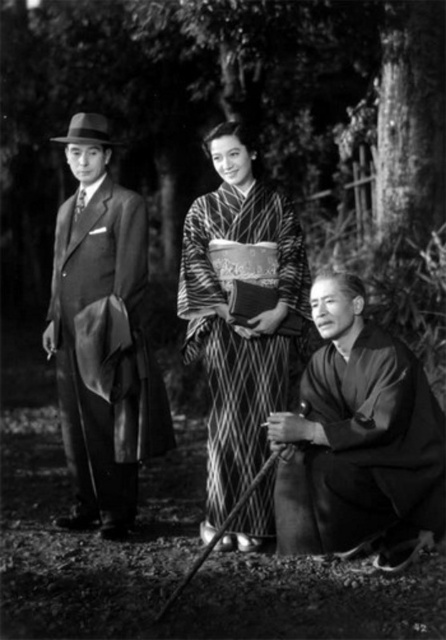
Question: Does silky kimono at lower right lie in front of silky kimono at center?

Choices:
 (A) yes
 (B) no

Answer: (A)

Question: Does silky kimono at lower right appear on the left side of silky kimono at center?

Choices:
 (A) yes
 (B) no

Answer: (B)

Question: Can you confirm if silky kimono at lower right is wider than silky kimono at center?

Choices:
 (A) yes
 (B) no

Answer: (A)

Question: Which of the following is the closest to the observer?

Choices:
 (A) (263, 346)
 (B) (433, 508)
 (C) (82, 440)

Answer: (B)

Question: Which of the following is the farthest from the observer?

Choices:
 (A) (81, 125)
 (B) (318, 349)
 (C) (206, 328)

Answer: (A)

Question: Which object is the closest to the smooth black suit at left?

Choices:
 (A) silky kimono at lower right
 (B) silky kimono at center

Answer: (B)